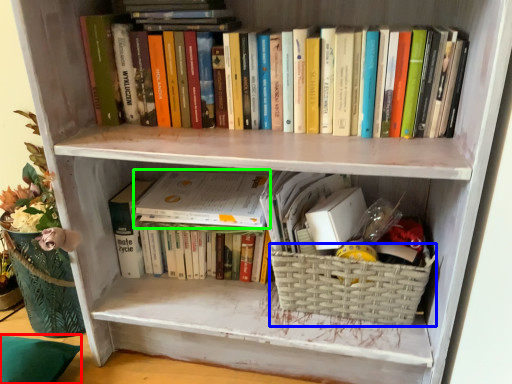
Question: Estimate the real-world distances between objects in this image. Which object is closer to pillow (highlighted by a red box), basket (highlighted by a blue box) or paperback book (highlighted by a green box)?

Choices:
 (A) basket
 (B) paperback book

Answer: (B)